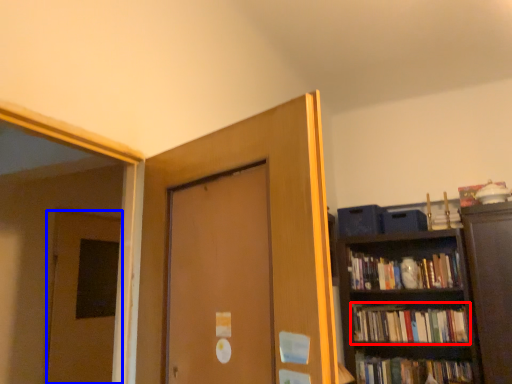
Question: Which of the following is the closest to the observer, book (highlighted by a red box) or door (highlighted by a blue box)?

Choices:
 (A) book
 (B) door

Answer: (B)